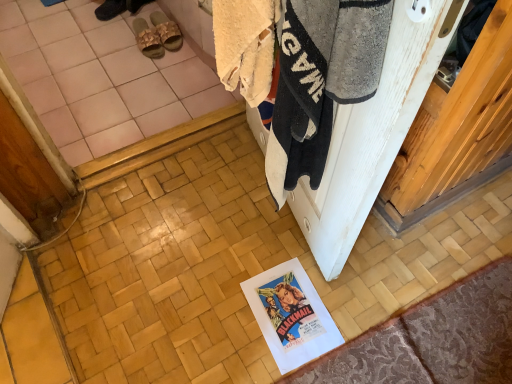
Question: Does patterned fabric doormat at lower right have a lesser width compared to beige woven slipper at upper left, the 1th footwear in the right-to-left sequence?

Choices:
 (A) yes
 (B) no

Answer: (B)

Question: Does patterned fabric doormat at lower right have a smaller size compared to beige woven slipper at upper left, the 1th footwear in the right-to-left sequence?

Choices:
 (A) yes
 (B) no

Answer: (B)

Question: Does patterned fabric doormat at lower right appear on the right side of beige woven slipper at upper left, acting as the third footwear starting from the left?

Choices:
 (A) yes
 (B) no

Answer: (A)

Question: Could you tell me if patterned fabric doormat at lower right is turned towards beige woven slipper at upper left, the 1th footwear in the right-to-left sequence?

Choices:
 (A) yes
 (B) no

Answer: (B)

Question: Can you confirm if patterned fabric doormat at lower right is wider than beige woven slipper at upper left, acting as the third footwear starting from the left?

Choices:
 (A) no
 (B) yes

Answer: (B)

Question: From the image's perspective, relative to beige woven slipper at upper left, acting as the third footwear starting from the left, is white fluffy towel at upper right above or below?

Choices:
 (A) above
 (B) below

Answer: (B)

Question: From a real-world perspective, is white fluffy towel at upper right positioned above or below beige woven slipper at upper left, acting as the third footwear starting from the left?

Choices:
 (A) above
 (B) below

Answer: (A)

Question: In terms of width, does white fluffy towel at upper right look wider or thinner when compared to beige woven slipper at upper left, the 1th footwear in the right-to-left sequence?

Choices:
 (A) thin
 (B) wide

Answer: (A)

Question: Is point (385, 16) closer or farther from the camera than point (165, 23)?

Choices:
 (A) closer
 (B) farther

Answer: (A)

Question: Considering their positions, is dark brown leather sandals at upper center, positioned as the 3th footwear in right-to-left order, located in front of or behind white paper at lower center?

Choices:
 (A) behind
 (B) front

Answer: (A)

Question: From the image's perspective, is dark brown leather sandals at upper center, which is the 1th footwear in left-to-right order, above or below white paper at lower center?

Choices:
 (A) above
 (B) below

Answer: (A)

Question: In terms of height, does dark brown leather sandals at upper center, positioned as the 3th footwear in right-to-left order, look taller or shorter compared to white paper at lower center?

Choices:
 (A) short
 (B) tall

Answer: (B)

Question: In the image, is dark brown leather sandals at upper center, which is the 1th footwear in left-to-right order, on the left side or the right side of white paper at lower center?

Choices:
 (A) left
 (B) right

Answer: (A)

Question: Is patterned fabric doormat at lower right wider or thinner than dark brown leather sandals at upper center, which is the 1th footwear in left-to-right order?

Choices:
 (A) wide
 (B) thin

Answer: (A)

Question: Considering the positions of point (342, 375) and point (105, 14), is point (342, 375) closer or farther from the camera than point (105, 14)?

Choices:
 (A) closer
 (B) farther

Answer: (A)